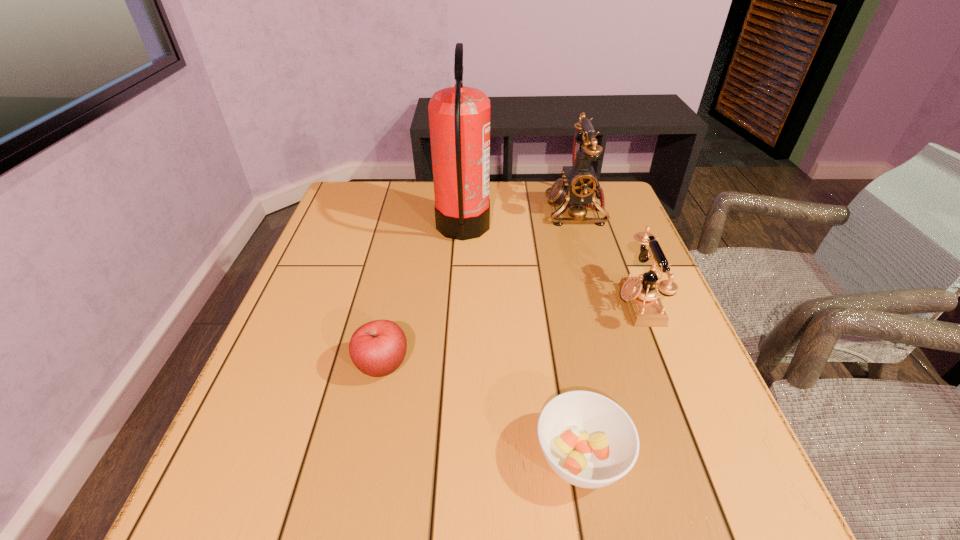
Locate an element on the screen. This screenshot has width=960, height=540. telephone that is at the far edge is located at coordinates (580, 184).

Locate an element on the screen. The width and height of the screenshot is (960, 540). object that is at the near edge is located at coordinates (588, 440).

The image size is (960, 540). Find the location of `object that is at the far right corner`. object that is at the far right corner is located at coordinates (580, 184).

At what (x,y) coordinates should I click in order to perform the action: click on free space at the far edge. Please return your answer as a coordinate pair (x, y). This screenshot has height=540, width=960. Looking at the image, I should click on (405, 209).

Find the location of `vacant region at the near edge of the desktop`. vacant region at the near edge of the desktop is located at coordinates (520, 500).

At what (x,y) coordinates should I click in order to perform the action: click on free space at the left edge of the desktop. Please return your answer as a coordinate pair (x, y). The width and height of the screenshot is (960, 540). Looking at the image, I should click on (250, 429).

Locate an element on the screen. The image size is (960, 540). vacant region at the right edge of the desktop is located at coordinates (674, 441).

This screenshot has width=960, height=540. In the image, there is a desktop. Identify the location of vacant space at the far left corner. (349, 212).

Image resolution: width=960 pixels, height=540 pixels. Identify the location of free region at the far right corner. (623, 216).

The image size is (960, 540). I want to click on free space at the near right corner of the desktop, so click(x=654, y=494).